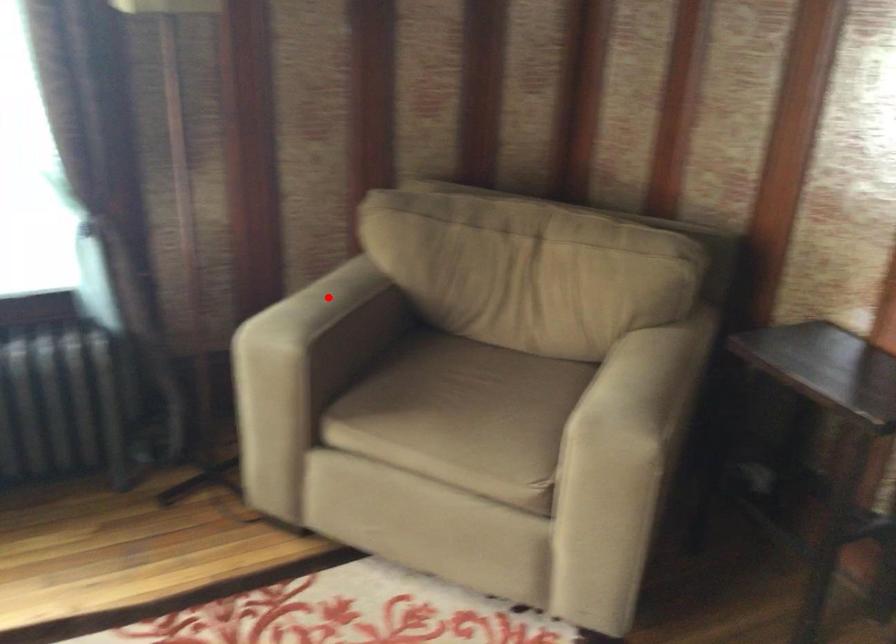
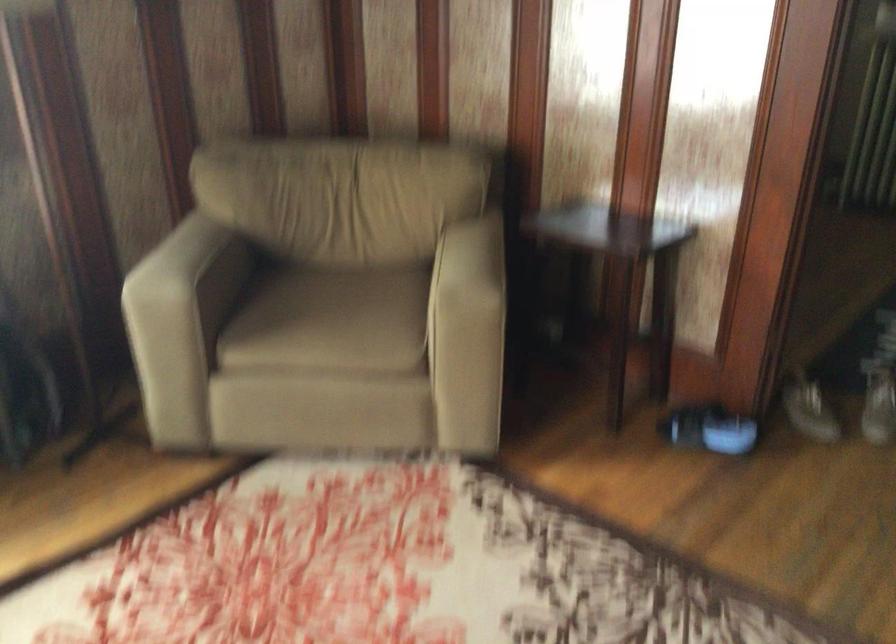
In the second image, find the point that corresponds to the highlighted location in the first image.

(194, 245)